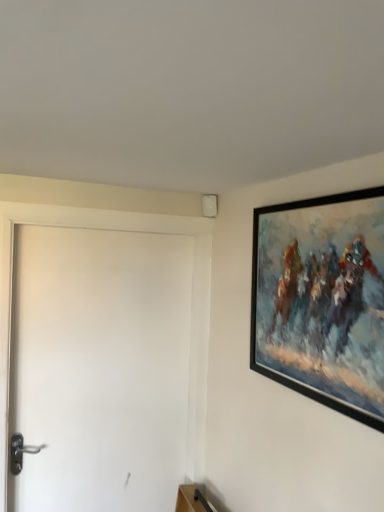
Question: From the image's perspective, would you say white matte door at left is positioned over black matte picture frame at upper right?

Choices:
 (A) no
 (B) yes

Answer: (A)

Question: Is white matte door at left touching black matte picture frame at upper right?

Choices:
 (A) no
 (B) yes

Answer: (A)

Question: Is white matte door at left wider than black matte picture frame at upper right?

Choices:
 (A) no
 (B) yes

Answer: (B)

Question: Is white matte door at left surrounding black matte picture frame at upper right?

Choices:
 (A) yes
 (B) no

Answer: (B)

Question: Does white matte door at left appear on the left side of black matte picture frame at upper right?

Choices:
 (A) no
 (B) yes

Answer: (B)

Question: Is white matte door at left far away from black matte picture frame at upper right?

Choices:
 (A) no
 (B) yes

Answer: (A)

Question: Is white matte door at left completely or partially inside black matte picture frame at upper right?

Choices:
 (A) no
 (B) yes

Answer: (A)

Question: Is black matte picture frame at upper right positioned far away from white matte door at left?

Choices:
 (A) no
 (B) yes

Answer: (A)

Question: Is black matte picture frame at upper right at the right side of white matte door at left?

Choices:
 (A) no
 (B) yes

Answer: (B)

Question: Does black matte picture frame at upper right have a lesser height compared to white matte door at left?

Choices:
 (A) no
 (B) yes

Answer: (B)

Question: From a real-world perspective, is black matte picture frame at upper right physically below white matte door at left?

Choices:
 (A) yes
 (B) no

Answer: (B)

Question: Could you tell me if black matte picture frame at upper right is turned towards white matte door at left?

Choices:
 (A) no
 (B) yes

Answer: (A)

Question: Considering the positions of white matte door at left and black matte picture frame at upper right in the image, is white matte door at left wider or thinner than black matte picture frame at upper right?

Choices:
 (A) wide
 (B) thin

Answer: (A)